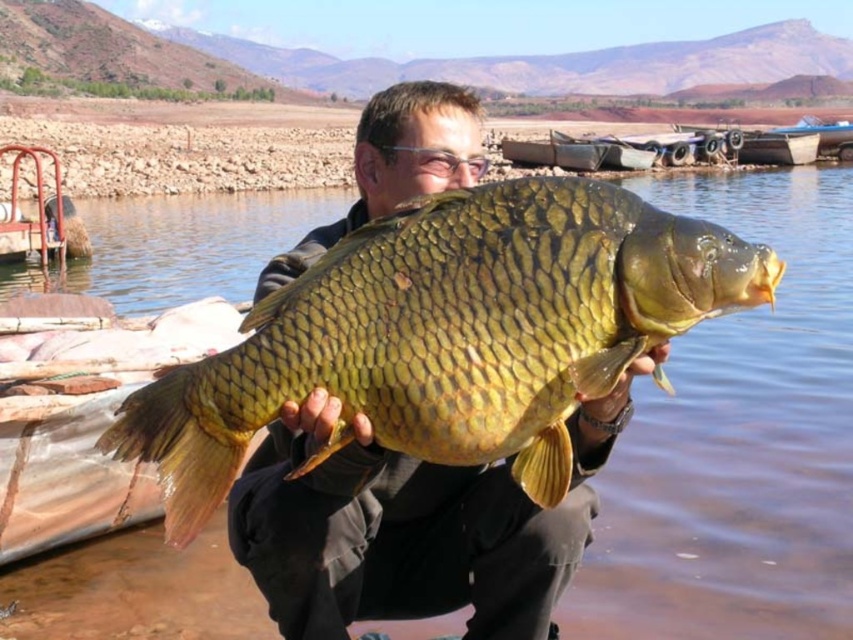
What do you see at coordinates (450, 333) in the screenshot? Image resolution: width=853 pixels, height=640 pixels. I see `shiny gold scales at center` at bounding box center [450, 333].

The height and width of the screenshot is (640, 853). I want to click on shiny gold scales at center, so (x=450, y=333).